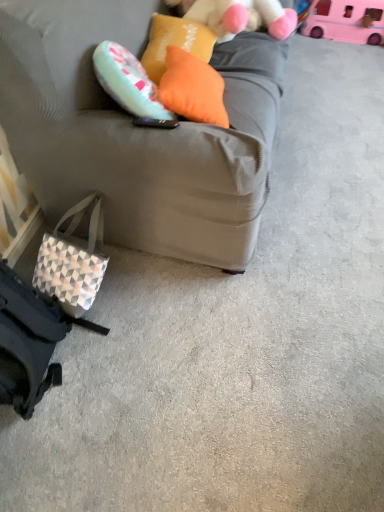
Locate an element on the screen. unoccupied region to the right of geometric-patterned fabric pouch at lower left is located at coordinates (147, 293).